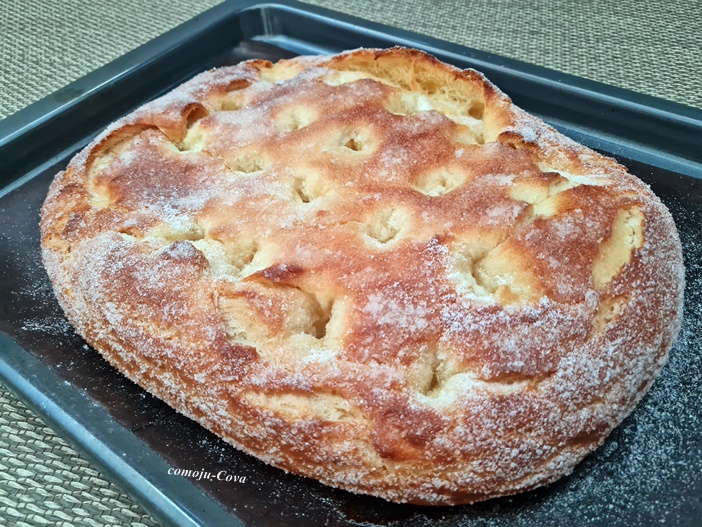
Locate an element on the screen. The image size is (702, 527). woven green and white table cloth is located at coordinates (55, 486).